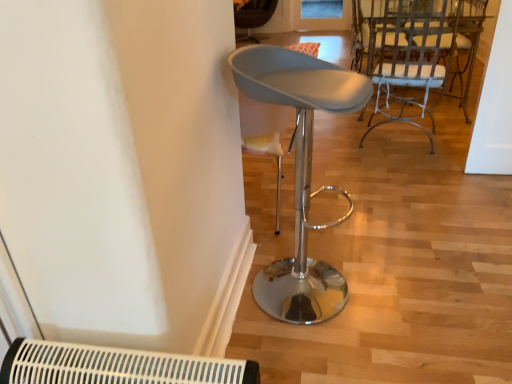
Image resolution: width=512 pixels, height=384 pixels. In order to click on free area below matte gray stool at center, the third chair viewed from the back (from a real-world perspective) in this screenshot , I will do `click(320, 296)`.